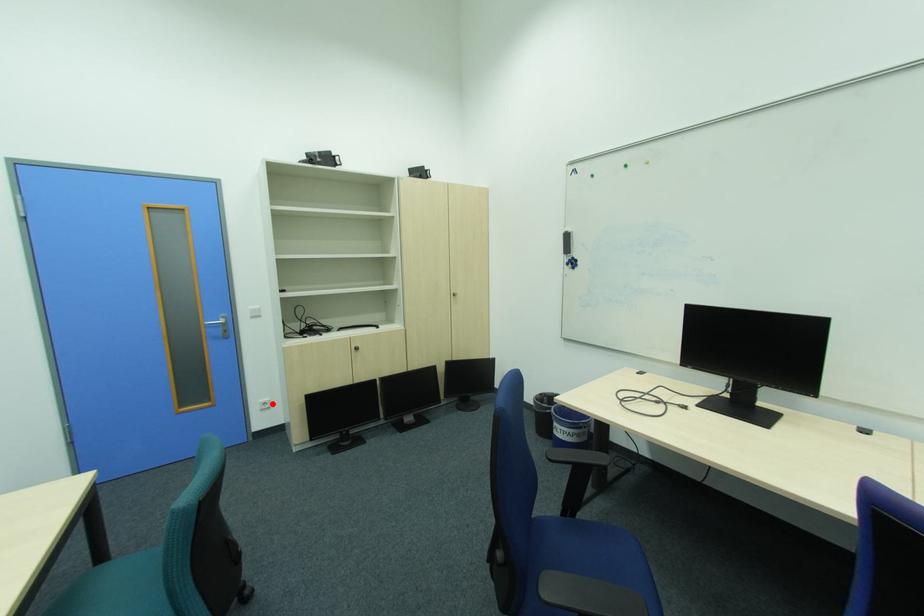
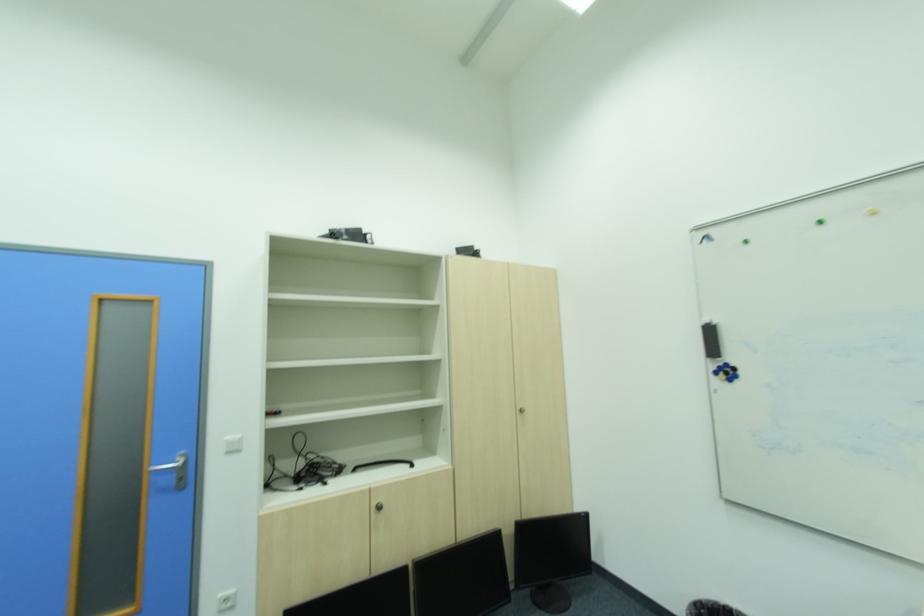
In the second image, find the point that corresponds to the highlighted location in the first image.

(234, 602)